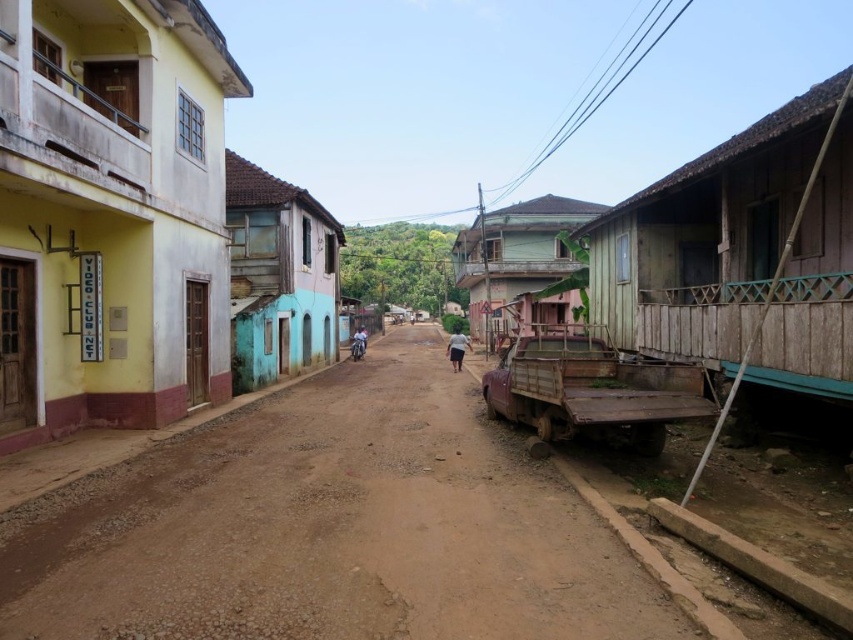
You are standing on the dirt street and want to walk towards the wooden hut at right and the light blue fabric shirt at center. Which object will you reach first?

The wooden hut at right is closer to the viewer than the light blue fabric shirt at center, so you will reach the wooden hut at right first.

You are standing on the dirt street and see the rustic wooden hut at center and the light blue fabric shirt at center. Which object is closer to you?

The rustic wooden hut at center is closer to you because the light blue fabric shirt at center is behind it.

You are standing on the quiet street scene and want to walk from point A to point B. Point A is at coordinates point[479,326] and point B is at point[366,337]. Which direction should you face to walk towards point B from point A?

Since point[479,326] is further to the viewer than point[366,337], you should face towards the direction away from you to reach point B from point A.